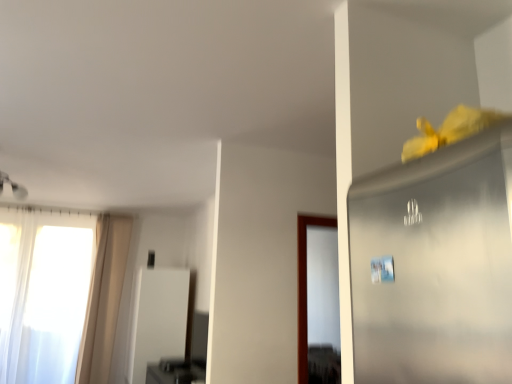
Question: Can you confirm if white glossy screen door at center is wider than white sheer curtain at left?

Choices:
 (A) yes
 (B) no

Answer: (A)

Question: Does white glossy screen door at center have a greater height compared to white sheer curtain at left?

Choices:
 (A) no
 (B) yes

Answer: (A)

Question: Considering the relative positions of white glossy screen door at center and white sheer curtain at left in the image provided, is white glossy screen door at center behind white sheer curtain at left?

Choices:
 (A) no
 (B) yes

Answer: (A)

Question: Can you confirm if white glossy screen door at center is positioned to the left of white sheer curtain at left?

Choices:
 (A) no
 (B) yes

Answer: (A)

Question: Is white glossy screen door at center located outside white sheer curtain at left?

Choices:
 (A) no
 (B) yes

Answer: (B)

Question: From a real-world perspective, is white glossy screen door at center located beneath white sheer curtain at left?

Choices:
 (A) yes
 (B) no

Answer: (A)

Question: Is beige fabric curtain at left closer to the viewer compared to white sheer curtain at left?

Choices:
 (A) yes
 (B) no

Answer: (B)

Question: Considering the relative sizes of beige fabric curtain at left and white sheer curtain at left in the image provided, is beige fabric curtain at left thinner than white sheer curtain at left?

Choices:
 (A) no
 (B) yes

Answer: (B)

Question: From a real-world perspective, is beige fabric curtain at left on white sheer curtain at left?

Choices:
 (A) no
 (B) yes

Answer: (B)

Question: Does beige fabric curtain at left have a greater height compared to white sheer curtain at left?

Choices:
 (A) yes
 (B) no

Answer: (B)

Question: From a real-world perspective, is beige fabric curtain at left positioned under white sheer curtain at left based on gravity?

Choices:
 (A) yes
 (B) no

Answer: (B)

Question: Is white sheer curtain at left surrounded by beige fabric curtain at left?

Choices:
 (A) no
 (B) yes

Answer: (A)

Question: Are white sheer curtain at left and beige fabric curtain at left located far from each other?

Choices:
 (A) no
 (B) yes

Answer: (A)